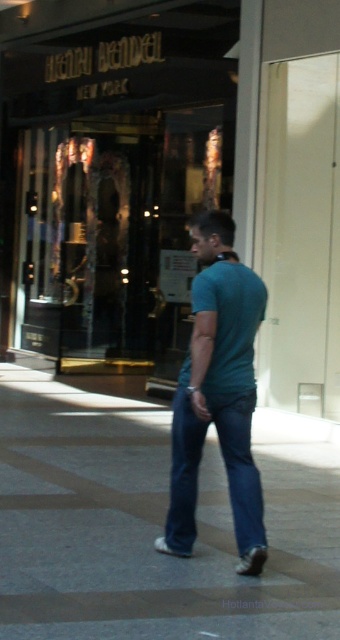
Question: Is blue denim jeans at center further to the viewer compared to blue matte t-shirt at center?

Choices:
 (A) yes
 (B) no

Answer: (B)

Question: Which object is farther from the camera taking this photo?

Choices:
 (A) blue matte t-shirt at center
 (B) blue denim jeans at center
 (C) smooth concrete pavement at center
 (D) glass storefront at center

Answer: (D)

Question: Which point is closer to the camera?

Choices:
 (A) blue matte t-shirt at center
 (B) blue denim jeans at center

Answer: (B)

Question: Where is glass storefront at center located in relation to smooth concrete pavement at center in the image?

Choices:
 (A) left
 (B) right

Answer: (A)

Question: Does smooth concrete pavement at center lie behind blue denim jeans at center?

Choices:
 (A) yes
 (B) no

Answer: (B)

Question: Which point appears closest to the camera in this image?

Choices:
 (A) (42, 470)
 (B) (165, 240)
 (C) (198, 448)
 (D) (243, 333)

Answer: (D)